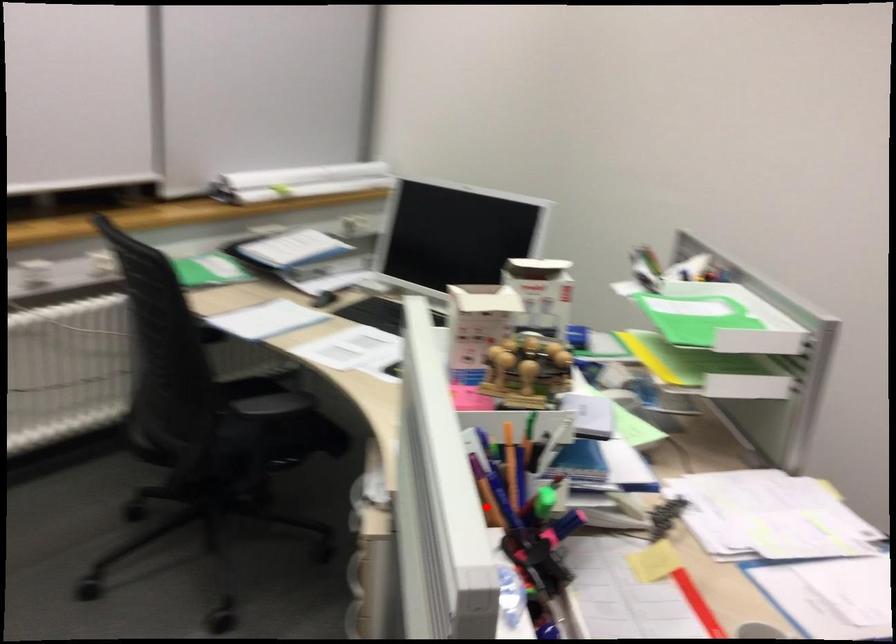
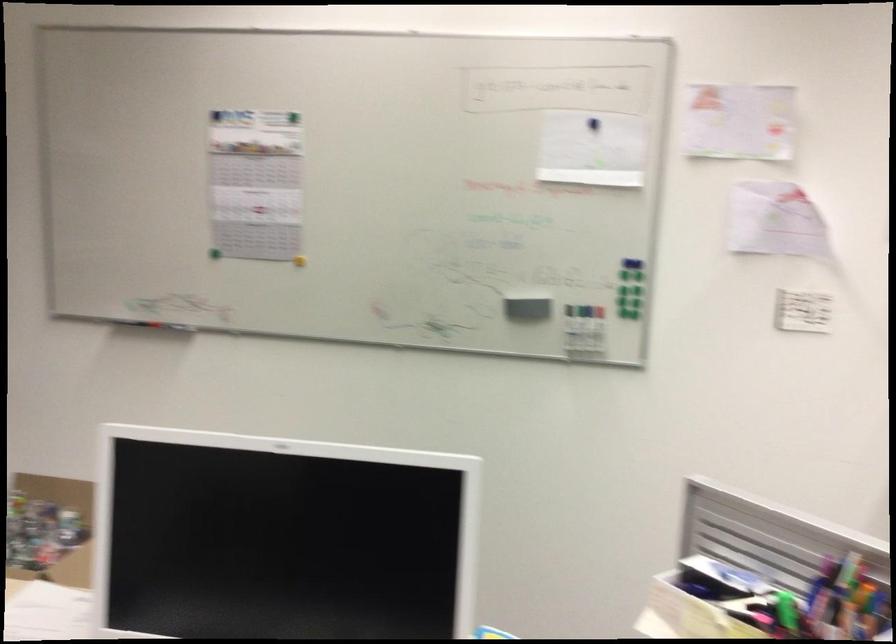
In the second image, find the point that corresponds to the highlighted location in the first image.

(787, 610)